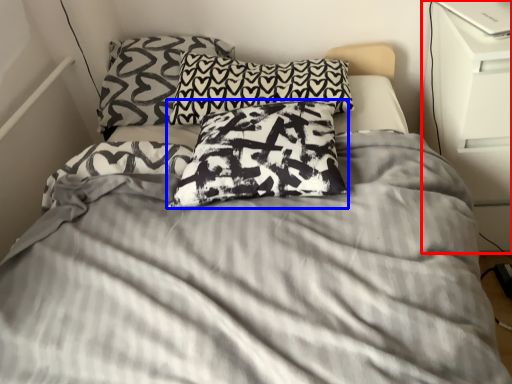
Question: Which point is closer to the camera, dresser (highlighted by a red box) or pillow (highlighted by a blue box)?

Choices:
 (A) dresser
 (B) pillow

Answer: (B)